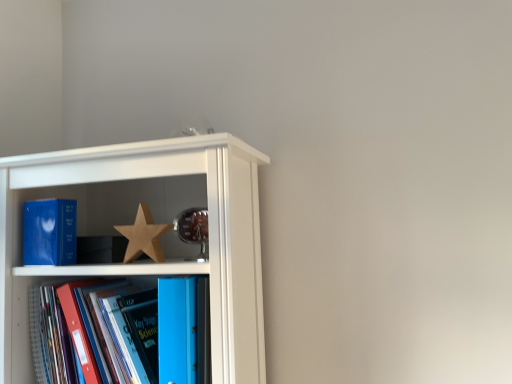
Question: Does blue matte book at left, arranged as the 3th book when viewed from the right, have a greater width compared to blue plastic folder at center, placed as the 3th book when sorted from left to right?

Choices:
 (A) no
 (B) yes

Answer: (A)

Question: From a real-world perspective, does blue matte book at left, which ranks as the first book in left-to-right order, stand above blue plastic folder at center, placed as the 3th book when sorted from left to right?

Choices:
 (A) no
 (B) yes

Answer: (B)

Question: Does blue matte book at left, arranged as the 3th book when viewed from the right, have a larger size compared to blue plastic folder at center, placed as the 3th book when sorted from left to right?

Choices:
 (A) no
 (B) yes

Answer: (A)

Question: Does blue matte book at left, which ranks as the first book in left-to-right order, touch blue plastic folder at center, which ranks as the 1th book in right-to-left order?

Choices:
 (A) yes
 (B) no

Answer: (B)

Question: Considering the relative positions of blue matte book at left, which ranks as the first book in left-to-right order, and blue plastic folder at center, placed as the 3th book when sorted from left to right, in the image provided, is blue matte book at left, which ranks as the first book in left-to-right order, to the left of blue plastic folder at center, placed as the 3th book when sorted from left to right, from the viewer's perspective?

Choices:
 (A) yes
 (B) no

Answer: (A)

Question: Is wooden star at center inside or outside of blue matte book at left, which ranks as the first book in left-to-right order?

Choices:
 (A) outside
 (B) inside

Answer: (A)

Question: Considering the positions of wooden star at center and blue matte book at left, arranged as the 3th book when viewed from the right, in the image, is wooden star at center taller or shorter than blue matte book at left, arranged as the 3th book when viewed from the right,?

Choices:
 (A) tall
 (B) short

Answer: (B)

Question: Considering the positions of point (144, 238) and point (37, 263), is point (144, 238) closer or farther from the camera than point (37, 263)?

Choices:
 (A) closer
 (B) farther

Answer: (A)

Question: Considering the positions of wooden star at center and blue matte book at left, arranged as the 3th book when viewed from the right, in the image, is wooden star at center bigger or smaller than blue matte book at left, arranged as the 3th book when viewed from the right,?

Choices:
 (A) small
 (B) big

Answer: (A)

Question: Would you say blue matte book at left, which ranks as the first book in left-to-right order, is to the left or to the right of blue plastic folder at center, which ranks as the 1th book in right-to-left order, in the picture?

Choices:
 (A) left
 (B) right

Answer: (A)

Question: Do you think blue matte book at left, arranged as the 3th book when viewed from the right, is within blue plastic folder at center, placed as the 3th book when sorted from left to right, or outside of it?

Choices:
 (A) outside
 (B) inside

Answer: (A)

Question: In terms of width, does blue matte book at left, arranged as the 3th book when viewed from the right, look wider or thinner when compared to blue plastic folder at center, placed as the 3th book when sorted from left to right?

Choices:
 (A) wide
 (B) thin

Answer: (B)

Question: From their relative heights in the image, would you say blue matte book at left, which ranks as the first book in left-to-right order, is taller or shorter than blue plastic folder at center, placed as the 3th book when sorted from left to right?

Choices:
 (A) tall
 (B) short

Answer: (B)

Question: Is blue matte book at left, which ranks as the first book in left-to-right order, taller or shorter than matte wooden shelf at upper left?

Choices:
 (A) short
 (B) tall

Answer: (A)

Question: Looking at their shapes, would you say blue matte book at left, which ranks as the first book in left-to-right order, is wider or thinner than matte wooden shelf at upper left?

Choices:
 (A) thin
 (B) wide

Answer: (A)